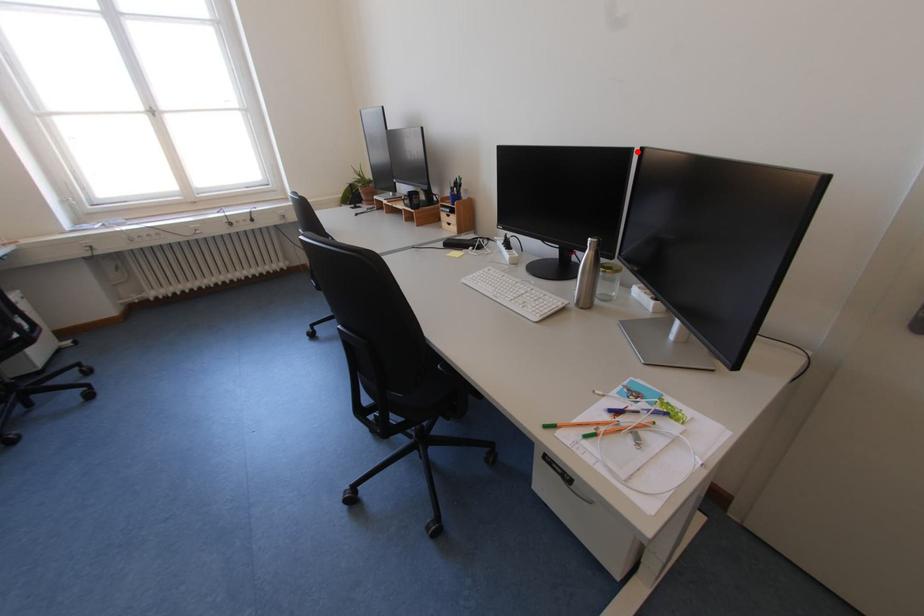
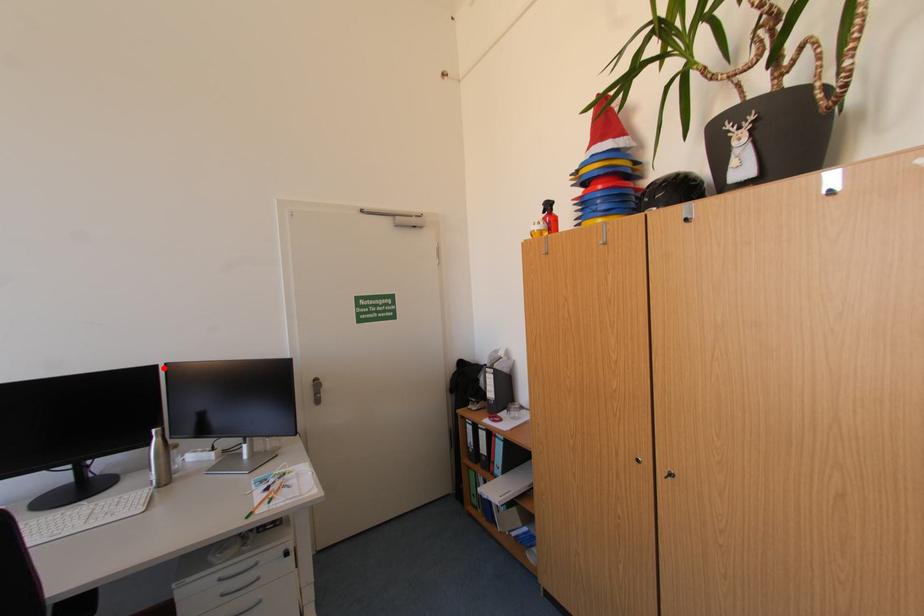
I am providing you with two images of the same scene from different viewpoints. A red point is marked on the first image and another point is marked on the second image. Is the marked point in image1 the same physical position as the marked point in image2?

Yes